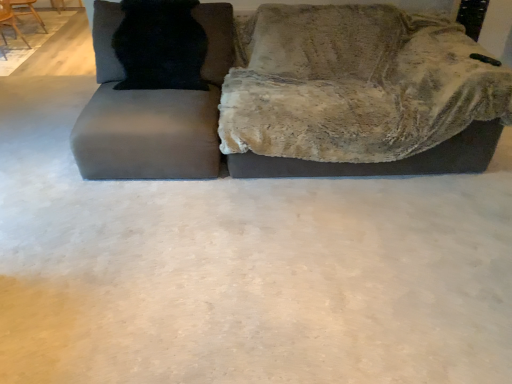
Question: Is velvet gray couch at upper center at the back of matte gray swivel chair at left?

Choices:
 (A) yes
 (B) no

Answer: (B)

Question: Is matte gray swivel chair at left to the left of velvet gray couch at upper center from the viewer's perspective?

Choices:
 (A) yes
 (B) no

Answer: (A)

Question: From a real-world perspective, is matte gray swivel chair at left under velvet gray couch at upper center?

Choices:
 (A) no
 (B) yes

Answer: (A)

Question: Considering the relative sizes of matte gray swivel chair at left and velvet gray couch at upper center in the image provided, is matte gray swivel chair at left shorter than velvet gray couch at upper center?

Choices:
 (A) yes
 (B) no

Answer: (B)

Question: From the image's perspective, is matte gray swivel chair at left beneath velvet gray couch at upper center?

Choices:
 (A) yes
 (B) no

Answer: (A)

Question: Relative to velvet gray couch at upper center, is black fur cat at upper left in front or behind?

Choices:
 (A) behind
 (B) front

Answer: (A)

Question: In terms of size, does black fur cat at upper left appear bigger or smaller than velvet gray couch at upper center?

Choices:
 (A) small
 (B) big

Answer: (A)

Question: In terms of width, does black fur cat at upper left look wider or thinner when compared to velvet gray couch at upper center?

Choices:
 (A) thin
 (B) wide

Answer: (A)

Question: Is black fur cat at upper left inside the boundaries of velvet gray couch at upper center, or outside?

Choices:
 (A) outside
 (B) inside

Answer: (A)

Question: From a real-world perspective, is matte gray swivel chair at left above or below velvet gray couch at upper center?

Choices:
 (A) below
 (B) above

Answer: (B)

Question: From the image's perspective, is matte gray swivel chair at left above or below velvet gray couch at upper center?

Choices:
 (A) below
 (B) above

Answer: (A)

Question: Relative to velvet gray couch at upper center, is matte gray swivel chair at left in front or behind?

Choices:
 (A) behind
 (B) front

Answer: (B)

Question: Considering the positions of point (84, 147) and point (105, 72), is point (84, 147) closer or farther from the camera than point (105, 72)?

Choices:
 (A) farther
 (B) closer

Answer: (B)

Question: Is wooden chair at upper left, the second chair from the back, spatially inside velvet gray couch at upper center, or outside of it?

Choices:
 (A) inside
 (B) outside

Answer: (B)

Question: Based on their positions, is wooden chair at upper left, which ranks as the 1th chair in front-to-back order, located to the left or right of velvet gray couch at upper center?

Choices:
 (A) left
 (B) right

Answer: (A)